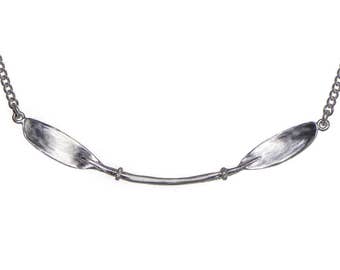
This screenshot has height=270, width=340. What are the coordinates of `bar` in the screenshot? It's located at (157, 180).